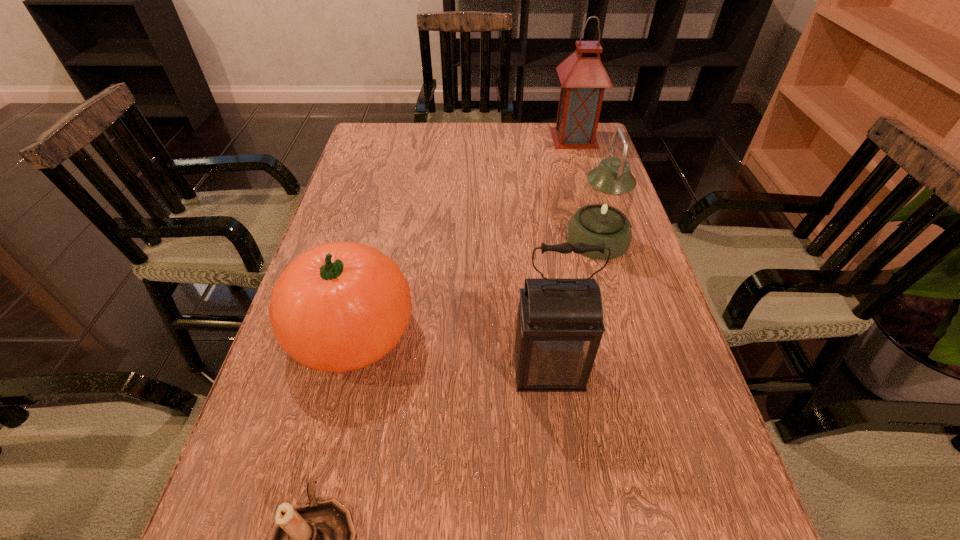
The image size is (960, 540). Find the location of `object that is at the left edge`. object that is at the left edge is located at coordinates (340, 306).

This screenshot has width=960, height=540. I want to click on object at the far right corner, so click(x=583, y=78).

At what (x,y) coordinates should I click in order to perform the action: click on vacant position at the far edge of the desktop. Please return your answer as a coordinate pair (x, y). The height and width of the screenshot is (540, 960). Looking at the image, I should click on (412, 146).

Locate an element on the screen. This screenshot has width=960, height=540. vacant region at the left edge of the desktop is located at coordinates (374, 166).

Where is `blank area at the right edge`? blank area at the right edge is located at coordinates (636, 271).

In order to click on free spot between the farthest object and the pumpkin in this screenshot , I will do `click(463, 235)`.

Where is `free space that is in between the pumpkin and the second farthest lantern`? This screenshot has height=540, width=960. free space that is in between the pumpkin and the second farthest lantern is located at coordinates (474, 285).

This screenshot has width=960, height=540. What are the coordinates of `vacant region between the pumpkin and the farthest object` in the screenshot? It's located at (463, 235).

At what (x,y) coordinates should I click in order to perform the action: click on vacant space that's between the leftmost lantern and the farthest object. Please return your answer as a coordinate pair (x, y). Image resolution: width=960 pixels, height=540 pixels. Looking at the image, I should click on (562, 254).

In order to click on free space between the second nearest lantern and the pumpkin in this screenshot , I will do `click(474, 285)`.